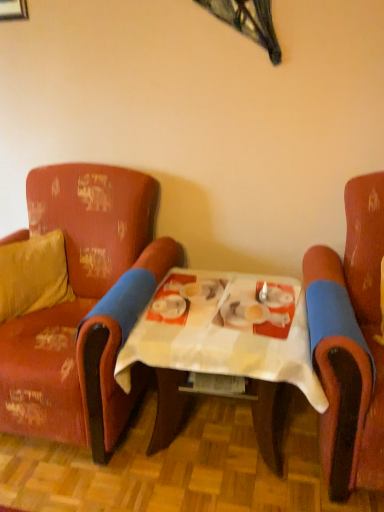
Question: Is white checkered table at center in front of distressed red fabric armchair at left, the first chair in the left-to-right sequence?

Choices:
 (A) no
 (B) yes

Answer: (B)

Question: Is white checkered table at center thinner than distressed red fabric armchair at left, the first chair in the left-to-right sequence?

Choices:
 (A) yes
 (B) no

Answer: (A)

Question: Considering the relative sizes of white checkered table at center and distressed red fabric armchair at left, which appears as the second chair when viewed from the right, in the image provided, is white checkered table at center bigger than distressed red fabric armchair at left, which appears as the second chair when viewed from the right,?

Choices:
 (A) yes
 (B) no

Answer: (B)

Question: From a real-world perspective, is white checkered table at center under distressed red fabric armchair at left, which appears as the second chair when viewed from the right?

Choices:
 (A) no
 (B) yes

Answer: (B)

Question: Considering the relative positions of white checkered table at center and distressed red fabric armchair at left, which appears as the second chair when viewed from the right, in the image provided, is white checkered table at center to the right of distressed red fabric armchair at left, which appears as the second chair when viewed from the right, from the viewer's perspective?

Choices:
 (A) no
 (B) yes

Answer: (B)

Question: Does white checkered table at center have a smaller size compared to distressed red fabric armchair at left, the first chair in the left-to-right sequence?

Choices:
 (A) no
 (B) yes

Answer: (B)

Question: Can you confirm if distressed red fabric armchair at left, the first chair in the left-to-right sequence, is smaller than velvet yellow pillow at left?

Choices:
 (A) no
 (B) yes

Answer: (A)

Question: Is distressed red fabric armchair at left, which appears as the second chair when viewed from the right, positioned with its back to velvet yellow pillow at left?

Choices:
 (A) yes
 (B) no

Answer: (A)

Question: Would you say distressed red fabric armchair at left, which appears as the second chair when viewed from the right, contains velvet yellow pillow at left?

Choices:
 (A) yes
 (B) no

Answer: (A)

Question: Can you confirm if distressed red fabric armchair at left, the first chair in the left-to-right sequence, is thinner than velvet yellow pillow at left?

Choices:
 (A) no
 (B) yes

Answer: (A)

Question: From a real-world perspective, is distressed red fabric armchair at left, the first chair in the left-to-right sequence, below velvet yellow pillow at left?

Choices:
 (A) yes
 (B) no

Answer: (A)

Question: Is distressed red fabric armchair at left, the first chair in the left-to-right sequence, taller than velvet yellow pillow at left?

Choices:
 (A) yes
 (B) no

Answer: (A)

Question: Is there a large distance between distressed red fabric armchair at left, which appears as the second chair when viewed from the right, and scratched leather armchair at right, marked as the 2th chair in a left-to-right arrangement?

Choices:
 (A) no
 (B) yes

Answer: (A)